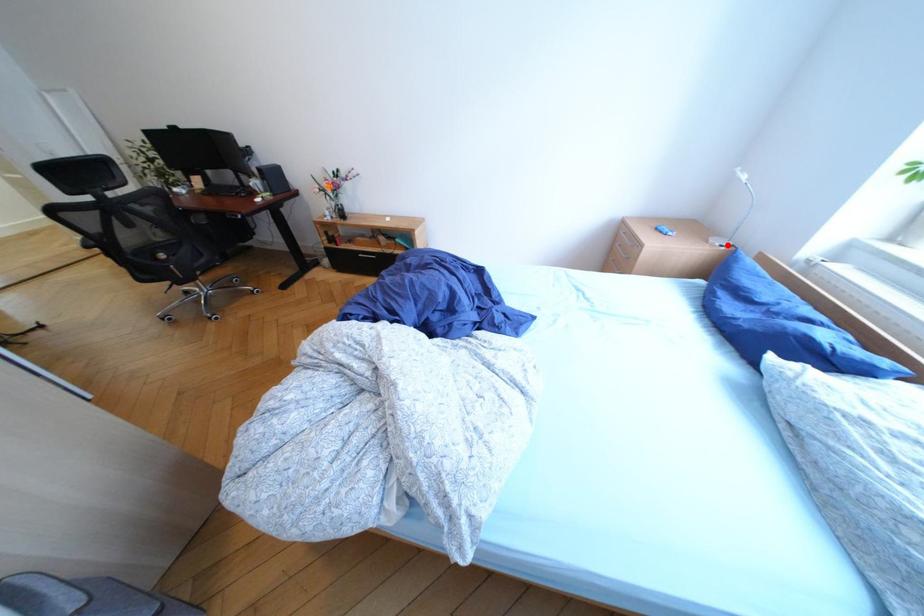
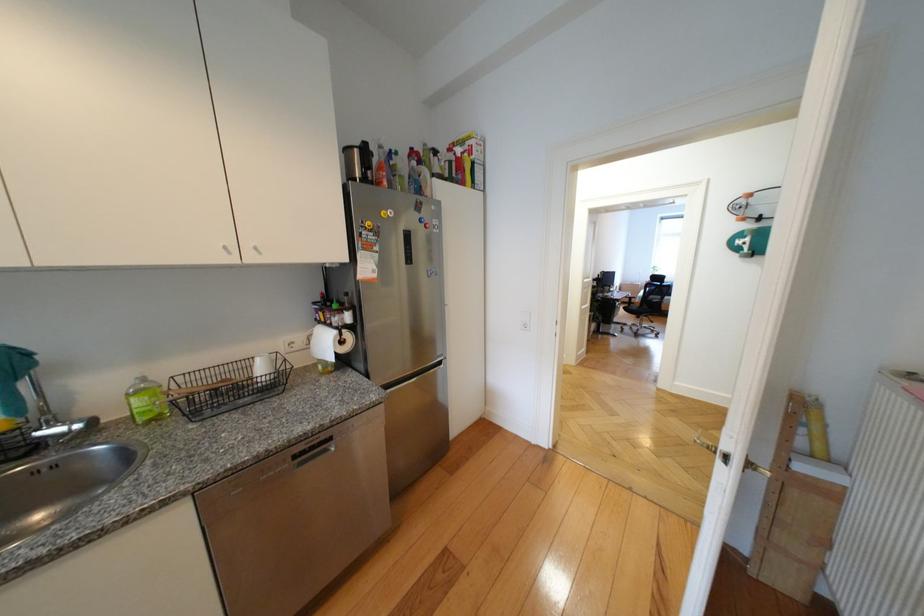
Question: I am providing you with two images of the same scene from different viewpoints. A red point is marked on the first image. Can you still see the location of the red point in image 2?

Choices:
 (A) Yes
 (B) No

Answer: (B)